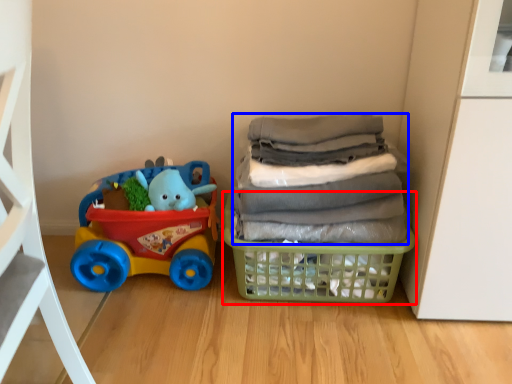
Question: Which point is closer to the camera, basket (highlighted by a red box) or laundry (highlighted by a blue box)?

Choices:
 (A) basket
 (B) laundry

Answer: (B)